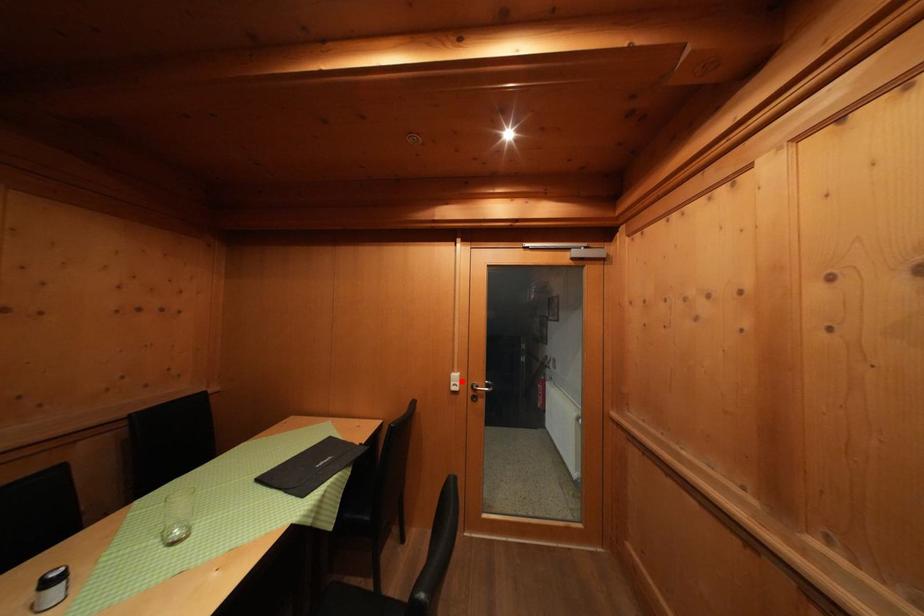
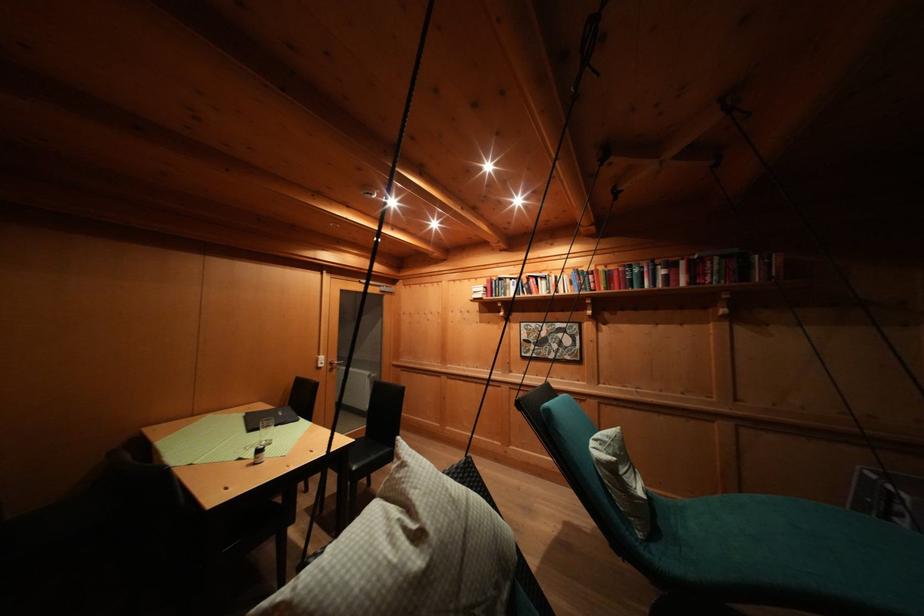
Find the pixel in the second image that matches the highlighted location in the first image.

(327, 362)